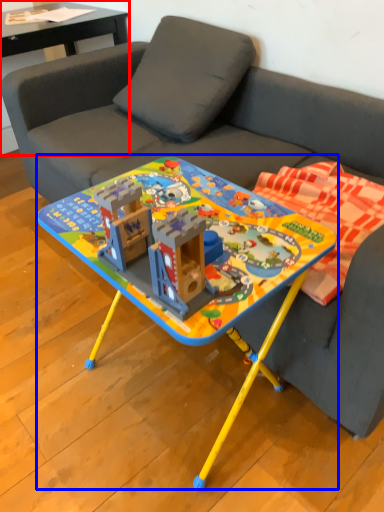
Question: Which of the following is the farthest to the observer, side table (highlighted by a red box) or table (highlighted by a blue box)?

Choices:
 (A) side table
 (B) table

Answer: (A)